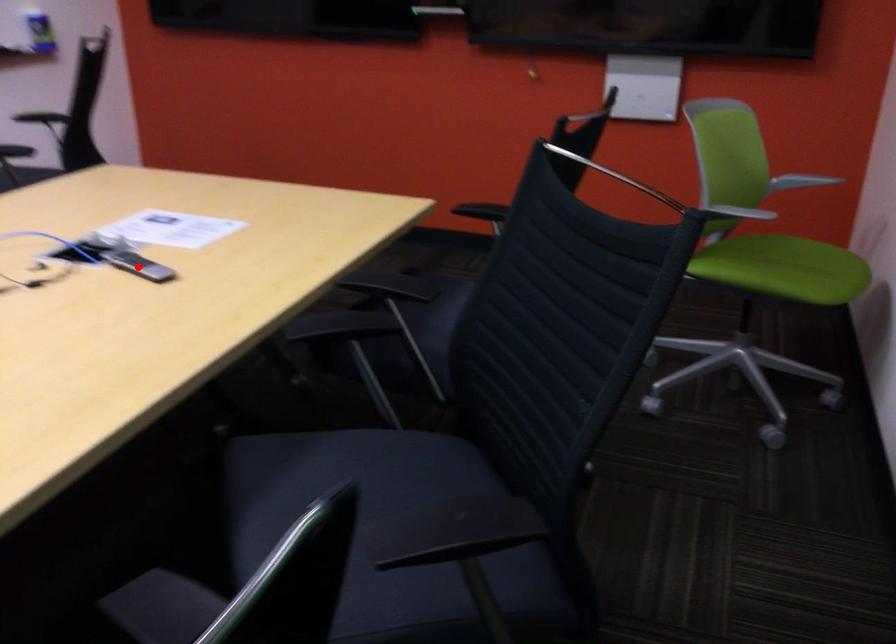
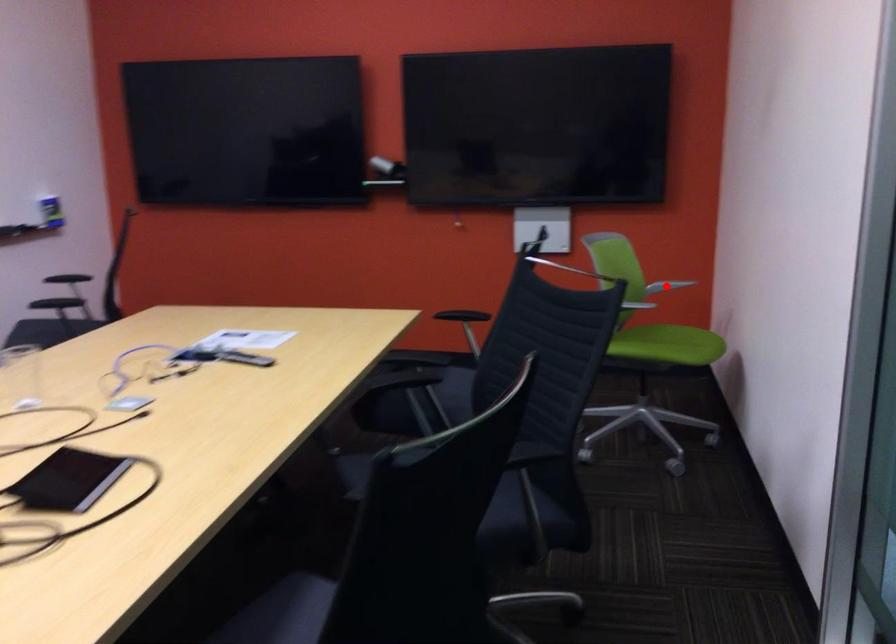
Looking at this image, I am providing you with two images of the same scene from different viewpoints. A red point is marked on the first image and another point is marked on the second image. Are the points marked in image1 and image2 representing the same 3D position?

No